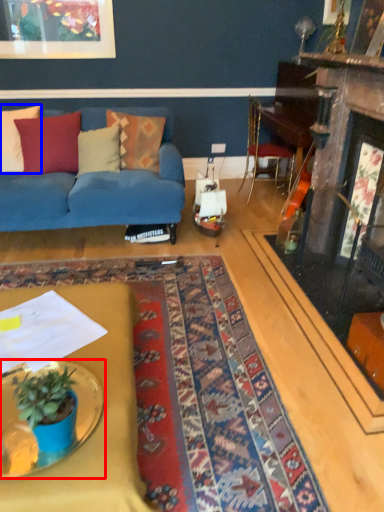
Question: Which point is further to the camera, table (highlighted by a red box) or pillow (highlighted by a blue box)?

Choices:
 (A) table
 (B) pillow

Answer: (B)